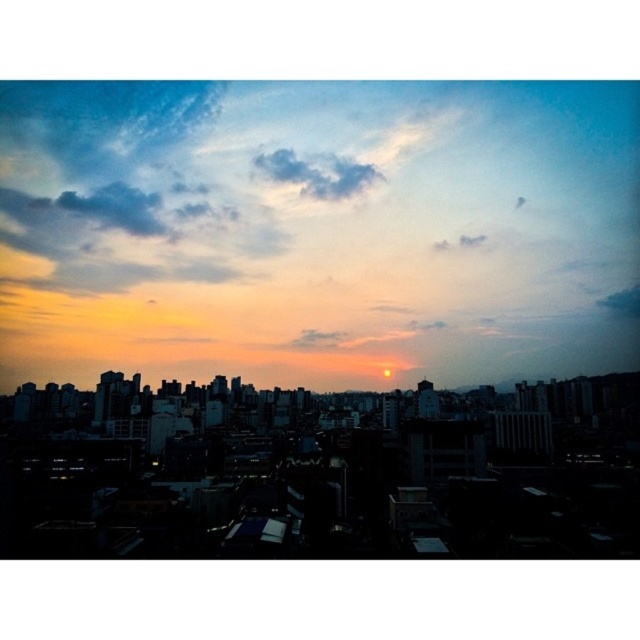
Is point (6, 260) positioned in front of point (352, 172)?

No, (6, 260) is behind (352, 172).

Locate an element on the screen. This screenshot has width=640, height=640. cloudy sky at center is located at coordinates (316, 230).

Between point (193, 282) and point (275, 172), which one is positioned behind?

Positioned behind is point (275, 172).

At what (x,y) coordinates should I click in order to perform the action: click on cloudy sky at center. Please return your answer as a coordinate pair (x, y). The height and width of the screenshot is (640, 640). Looking at the image, I should click on (316, 230).